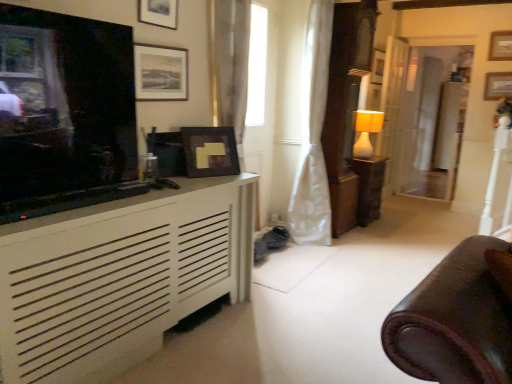
Where is `free space in front of matte black picture frame at upper center, placed as the 4th picture frame when sorted from back to front`? The image size is (512, 384). free space in front of matte black picture frame at upper center, placed as the 4th picture frame when sorted from back to front is located at coordinates (199, 180).